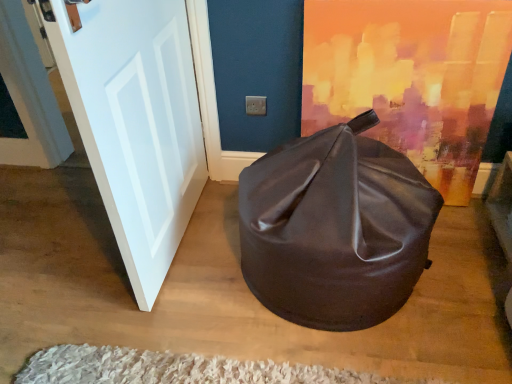
Locate an element on the screen. The image size is (512, 384). free area in between white glossy door at left and shiny brown bean bag at center is located at coordinates (209, 251).